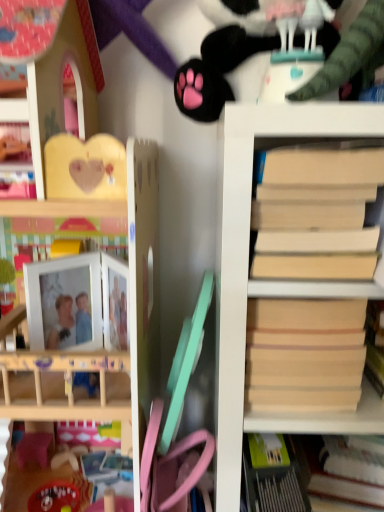
Question: Would you consider light beige wood bookshelf at right, which is the first shelf from right to left, to be distant from black plush paw at upper center?

Choices:
 (A) no
 (B) yes

Answer: (A)

Question: Is light beige wood bookshelf at right, which is the first shelf from right to left, looking in the opposite direction of black plush paw at upper center?

Choices:
 (A) no
 (B) yes

Answer: (A)

Question: From a real-world perspective, is light beige wood bookshelf at right, acting as the second shelf starting from the left, on black plush paw at upper center?

Choices:
 (A) yes
 (B) no

Answer: (B)

Question: Is light beige wood bookshelf at right, which is the first shelf from right to left, positioned in front of black plush paw at upper center?

Choices:
 (A) yes
 (B) no

Answer: (A)

Question: Does light beige wood bookshelf at right, which is the first shelf from right to left, appear on the right side of black plush paw at upper center?

Choices:
 (A) no
 (B) yes

Answer: (B)

Question: From the image's perspective, does light beige wood bookshelf at right, acting as the second shelf starting from the left, appear lower than black plush paw at upper center?

Choices:
 (A) yes
 (B) no

Answer: (A)

Question: From the image's perspective, is black plush paw at upper center over beige matte paper at right?

Choices:
 (A) no
 (B) yes

Answer: (B)

Question: Does black plush paw at upper center have a smaller size compared to beige matte paper at right?

Choices:
 (A) no
 (B) yes

Answer: (A)

Question: Could you tell me if black plush paw at upper center is turned towards beige matte paper at right?

Choices:
 (A) yes
 (B) no

Answer: (B)

Question: Does black plush paw at upper center have a greater width compared to beige matte paper at right?

Choices:
 (A) no
 (B) yes

Answer: (B)

Question: Is the position of black plush paw at upper center less distant than that of beige matte paper at right?

Choices:
 (A) no
 (B) yes

Answer: (A)

Question: Can you see black plush paw at upper center touching beige matte paper at right?

Choices:
 (A) yes
 (B) no

Answer: (B)

Question: Can you confirm if wooden dollhouse at upper left, acting as the 1th shelf starting from the left, is positioned to the left of beige cardboard book at right?

Choices:
 (A) yes
 (B) no

Answer: (A)